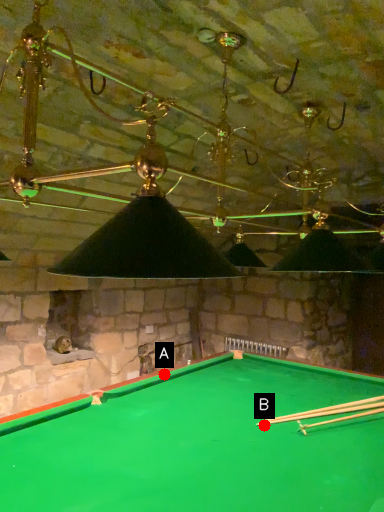
Question: Two points are circled on the image, labeled by A and B beside each circle. Which of the following is the farthest from the observer?

Choices:
 (A) A is further
 (B) B is further

Answer: (A)